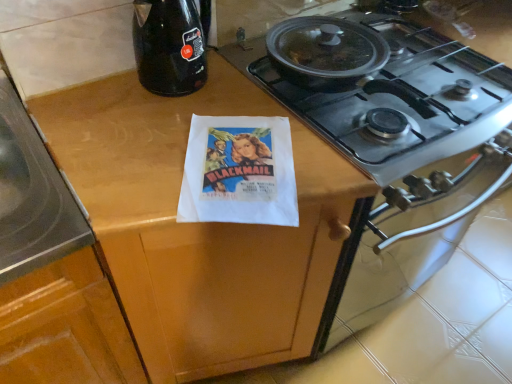
Identify the location of free point above wooden at center (from a real-world perspective). (195, 140).